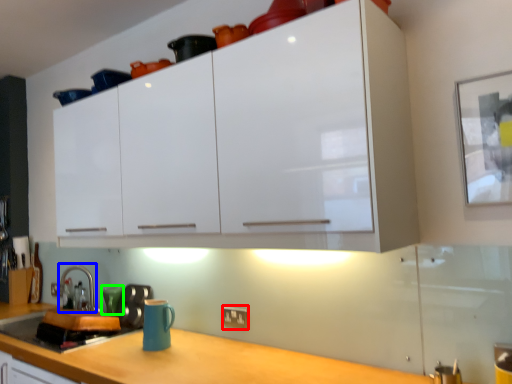
Question: Estimate the real-world distances between objects in this image. Which object is closer to electric outlet (highlighted by a red box), faucet (highlighted by a blue box) or teal (highlighted by a green box)?

Choices:
 (A) faucet
 (B) teal

Answer: (B)